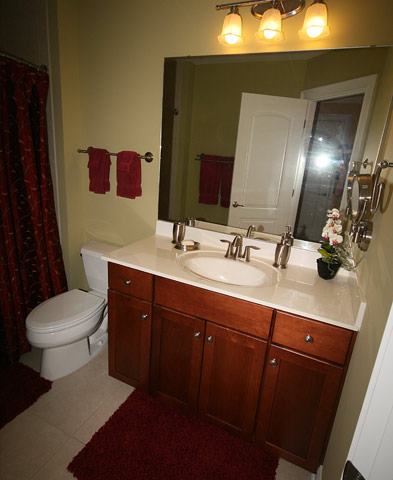
Image resolution: width=393 pixels, height=480 pixels. I want to click on bathroom sink, so click(242, 275).